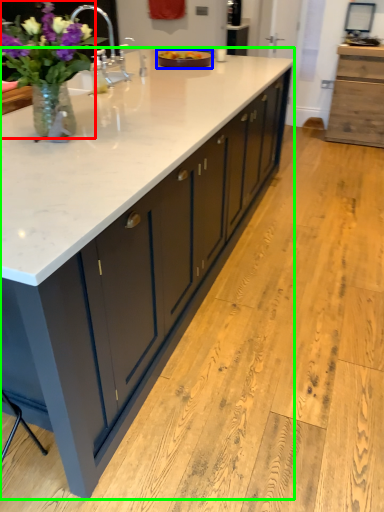
Question: Estimate the real-world distances between objects in this image. Which object is farther from houseplant (highlighted by a red box), tray (highlighted by a blue box) or countertop (highlighted by a green box)?

Choices:
 (A) tray
 (B) countertop

Answer: (A)